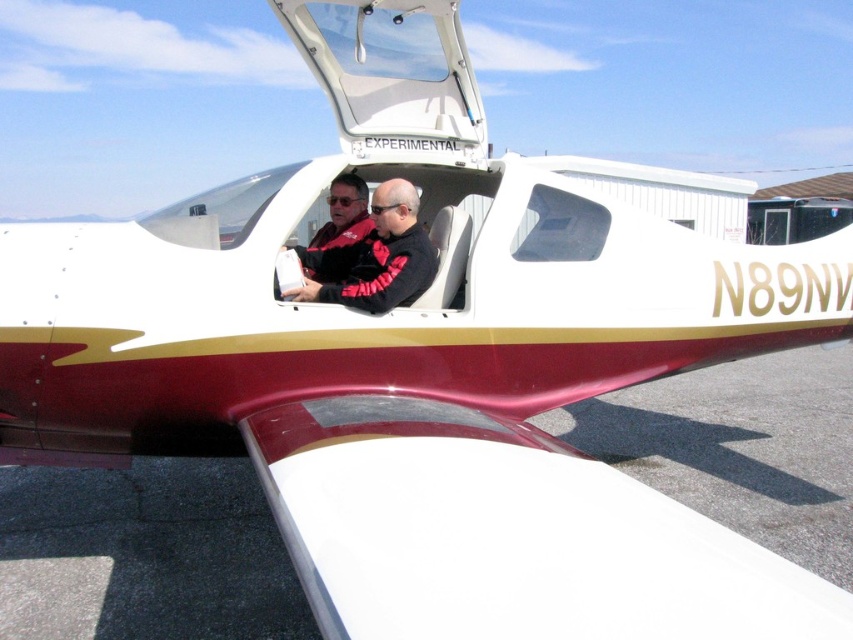
Is black leather jacket at center further to camera compared to red and black jacket at center?

That is False.

Between black leather jacket at center and red and black jacket at center, which one is positioned higher?

red and black jacket at center is higher up.

Who is more forward, [358,257] or [332,182]?

Point [358,257]

The image size is (853, 640). In order to click on black leather jacket at center in this screenshot , I will do `click(374, 257)`.